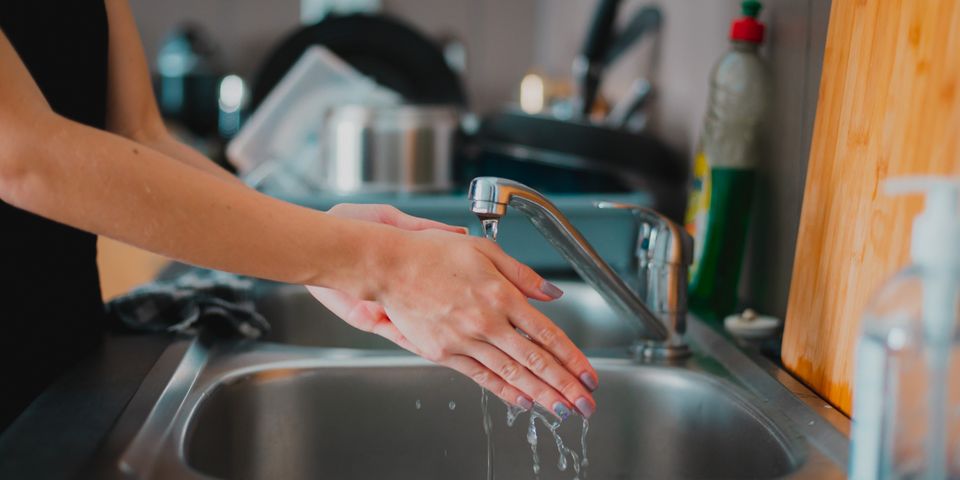
At what (x,y) coordinates should I click in order to perform the action: click on rinsing sink. Please return your answer as a coordinate pair (x, y). This screenshot has width=960, height=480. Looking at the image, I should click on (324, 439).